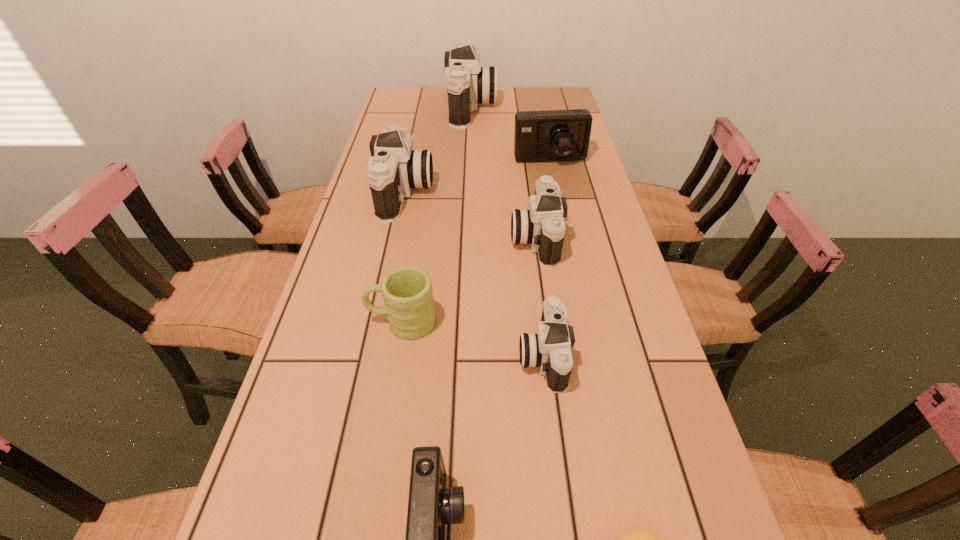
The height and width of the screenshot is (540, 960). I want to click on mug situated at the left edge, so click(x=407, y=291).

The width and height of the screenshot is (960, 540). What are the coordinates of `vacant point at the left edge` in the screenshot? It's located at (281, 488).

In the image, there is a desktop. Identify the location of free space at the right edge. This screenshot has height=540, width=960. (606, 213).

Where is `free space at the far left corner of the desktop`? The width and height of the screenshot is (960, 540). free space at the far left corner of the desktop is located at coordinates (399, 99).

Find the location of `free space between the tallest camera and the green mug`. free space between the tallest camera and the green mug is located at coordinates (437, 215).

This screenshot has height=540, width=960. Find the location of `empty space between the second biggest black camera and the second smallest black camera`. empty space between the second biggest black camera and the second smallest black camera is located at coordinates (470, 215).

Select which object is the fourth closest to the smaller blue camera. Please provide its 2D coordinates. Your answer should be formatted as a tuple, i.e. [(x, y)], where the tuple contains the x and y coordinates of a point satisfying the conditions above.

[(542, 226)]

This screenshot has height=540, width=960. I want to click on the third closest object to the right blue camera, so click(x=395, y=169).

Where is `camera that can be found as the sixth closest to the mug`? camera that can be found as the sixth closest to the mug is located at coordinates (468, 83).

You are a GUI agent. You are given a task and a screenshot of the screen. Output one action in this format:
    pyautogui.click(x=<x>, y=<y>)
    Task: Click on the fourth closest camera to the right blue camera
    Image resolution: width=960 pixels, height=540 pixels.
    Given the screenshot: What is the action you would take?
    pyautogui.click(x=550, y=349)